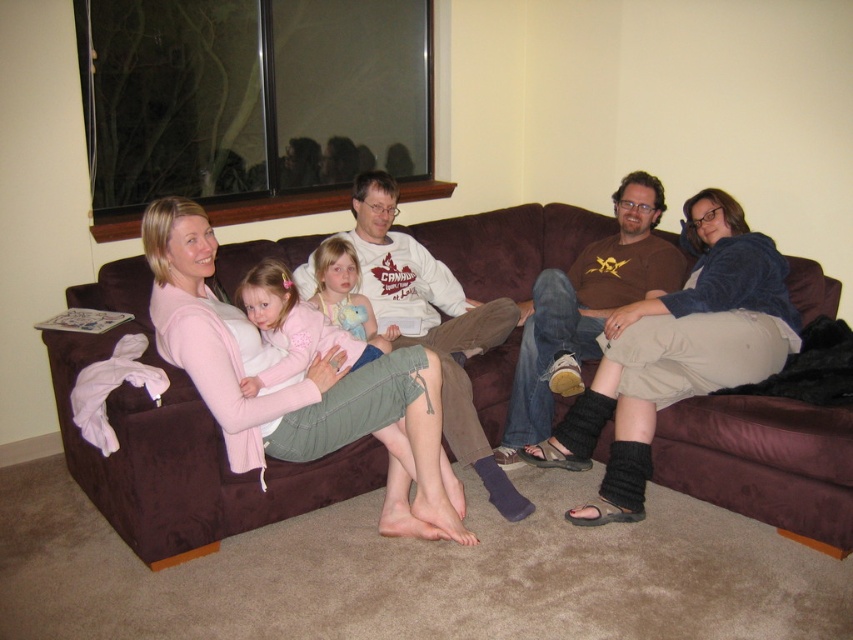
Can you confirm if knit beige socks at center is positioned to the left of matte pink sweater at center?

No, knit beige socks at center is not to the left of matte pink sweater at center.

Can you confirm if knit beige socks at center is positioned below matte pink sweater at center?

Yes, knit beige socks at center is below matte pink sweater at center.

Describe the element at coordinates (677, 353) in the screenshot. I see `knit beige socks at center` at that location.

Identify the location of knit beige socks at center. This screenshot has width=853, height=640. (677, 353).

Which is below, knit beige socks at center or light pink sweater at center?

knit beige socks at center is below.

Is knit beige socks at center behind light pink sweater at center?

No, knit beige socks at center is closer to the viewer.

Is point (724, 208) closer to camera compared to point (463, 362)?

Yes, it is in front of point (463, 362).

You are a GUI agent. You are given a task and a screenshot of the screen. Output one action in this format:
    pyautogui.click(x=<x>, y=<y>)
    Task: Click on the knit beige socks at center
    The image size is (853, 640).
    Given the screenshot: What is the action you would take?
    pyautogui.click(x=677, y=353)

Can you confirm if brown suede couch at center is smaller than light pink sweater at center?

Yes, brown suede couch at center is smaller than light pink sweater at center.

Does brown suede couch at center lie behind light pink sweater at center?

No, it is in front of light pink sweater at center.

What do you see at coordinates (177, 444) in the screenshot? This screenshot has height=640, width=853. I see `brown suede couch at center` at bounding box center [177, 444].

What are the coordinates of `brown suede couch at center` in the screenshot? It's located at (177, 444).